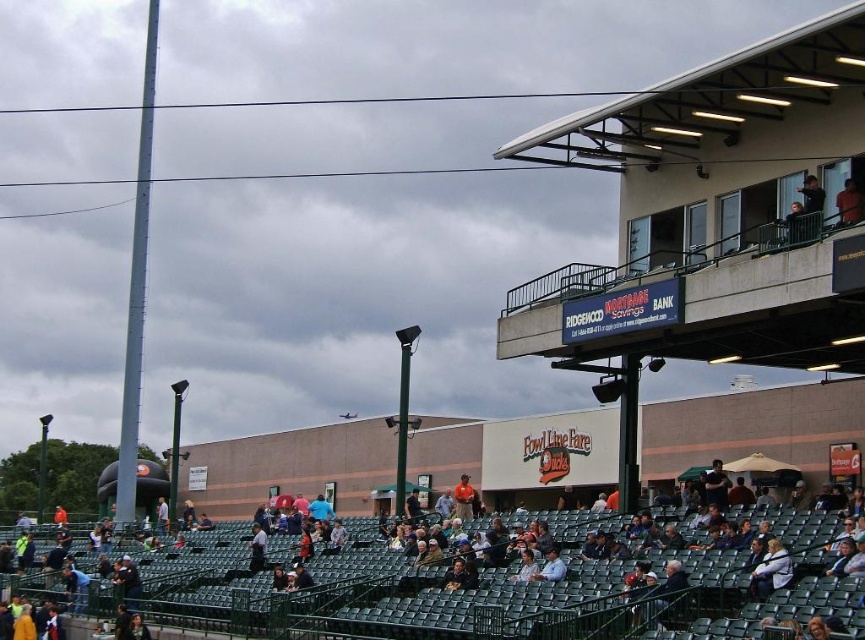
Is orange shirt at upper right smaller than light brown leather jacket at lower center?

Actually, orange shirt at upper right might be larger than light brown leather jacket at lower center.

Where is `orange shirt at upper right`? The image size is (865, 640). orange shirt at upper right is located at coordinates (849, 204).

Is point (430, 632) closer to camera compared to point (856, 211)?

No, (430, 632) is behind (856, 211).

Which of these two, dark gray seats at lower center or orange shirt at upper right, stands taller?

dark gray seats at lower center

Find the location of a particular element. This screenshot has height=640, width=865. dark gray seats at lower center is located at coordinates (501, 588).

Does point (652, 596) come behind point (550, 566)?

No, it is in front of (550, 566).

Between dark gray seats at lower center and light brown leather jacket at lower center, which one is positioned higher?

light brown leather jacket at lower center is above.

Does point (380, 612) come behind point (545, 568)?

Yes, it is behind point (545, 568).

The width and height of the screenshot is (865, 640). I want to click on dark gray seats at lower center, so click(501, 588).